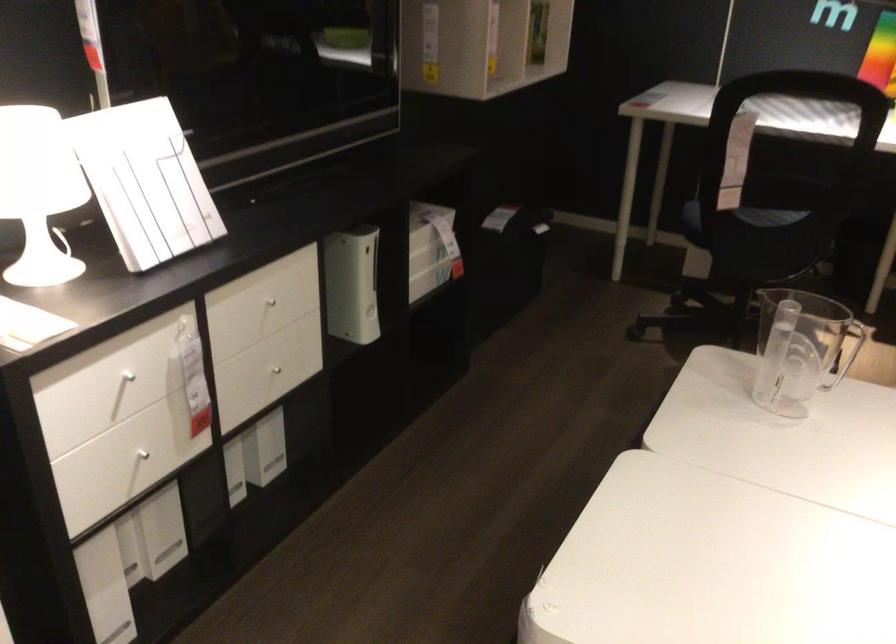
Image resolution: width=896 pixels, height=644 pixels. Describe the element at coordinates (848, 355) in the screenshot. I see `the pitcher handle` at that location.